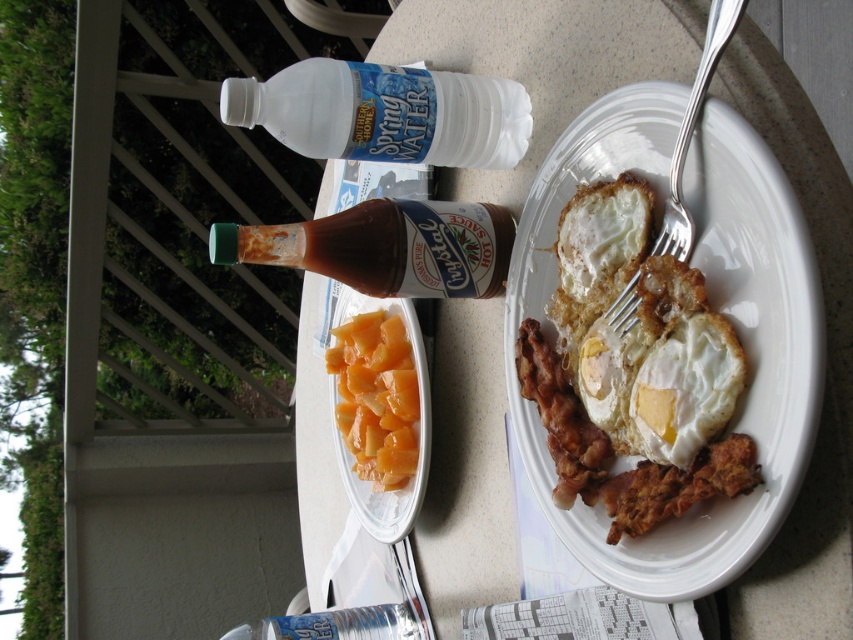
Is the position of white plastic bottle at upper center more distant than that of white fried egg at plate center?

Yes, it is behind white fried egg at plate center.

Who is taller, white plastic bottle at upper center or white fried egg at plate center?

white plastic bottle at upper center

Between point (328, 154) and point (601, 372), which one is positioned in front?

Point (601, 372) is more forward.

You are a GUI agent. You are given a task and a screenshot of the screen. Output one action in this format:
    pyautogui.click(x=<x>, y=<y>)
    Task: Click on the white plastic bottle at upper center
    The width and height of the screenshot is (853, 640).
    Given the screenshot: What is the action you would take?
    pyautogui.click(x=386, y=113)

Is golden fried eggs at plate right below white fried egg at plate center?

No.

Between golden fried eggs at plate right and white fried egg at plate center, which one has more height?

With more height is golden fried eggs at plate right.

Who is more forward, (724, 561) or (607, 394)?

Point (724, 561)

You are a GUI agent. You are given a task and a screenshot of the screen. Output one action in this format:
    pyautogui.click(x=<x>, y=<y>)
    Task: Click on the golden fried eggs at plate right
    This screenshot has height=640, width=853.
    Given the screenshot: What is the action you would take?
    pyautogui.click(x=714, y=304)

Does white glossy egg at plate center appear over white matte egg at upper right?

No.

Is point (735, 388) farther from camera compared to point (596, 259)?

No, (735, 388) is in front of (596, 259).

Which is in front, point (660, 365) or point (643, 225)?

Point (660, 365) is in front.

Where is `white glossy egg at plate center`? This screenshot has height=640, width=853. white glossy egg at plate center is located at coordinates point(685,388).